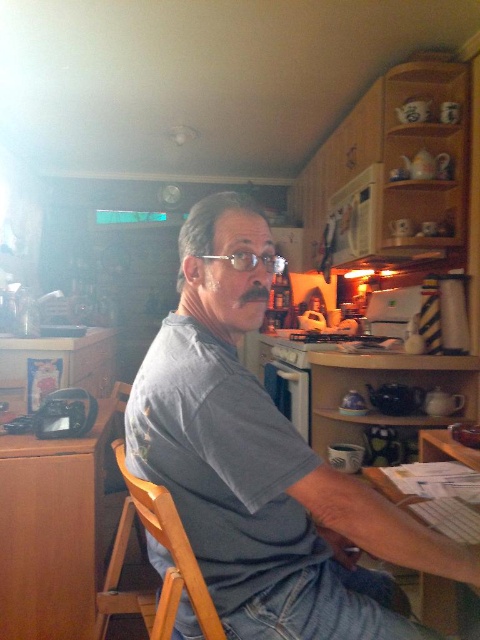
Question: Does gray cotton shirt at center lie in front of clear plastic glasses at center?

Choices:
 (A) no
 (B) yes

Answer: (B)

Question: Among these objects, which one is nearest to the camera?

Choices:
 (A) gray cotton shirt at center
 (B) brown wood table at lower left
 (C) wooden chair at center
 (D) wooden desk at lower right

Answer: (A)

Question: Which point is closer to the camera?

Choices:
 (A) (457, 611)
 (B) (372, 616)
 (C) (252, 257)

Answer: (B)

Question: Is gray cotton shirt at center to the right of clear plastic glasses at center from the viewer's perspective?

Choices:
 (A) no
 (B) yes

Answer: (A)

Question: Is gray cotton shirt at center bigger than wooden chair at center?

Choices:
 (A) yes
 (B) no

Answer: (A)

Question: Which of the following is the farthest from the observer?

Choices:
 (A) wooden desk at lower right
 (B) gray cotton shirt at center
 (C) wooden chair at center

Answer: (A)